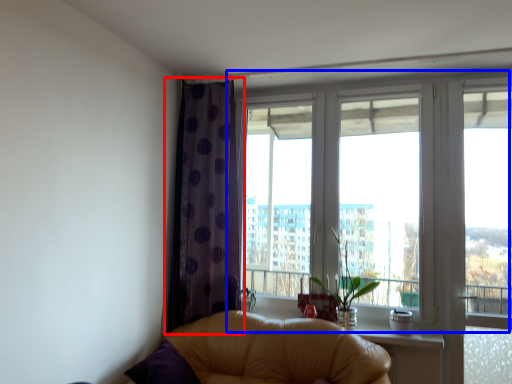
Question: Which object appears farthest to the camera in this image, curtain (highlighted by a red box) or window (highlighted by a blue box)?

Choices:
 (A) curtain
 (B) window

Answer: (A)